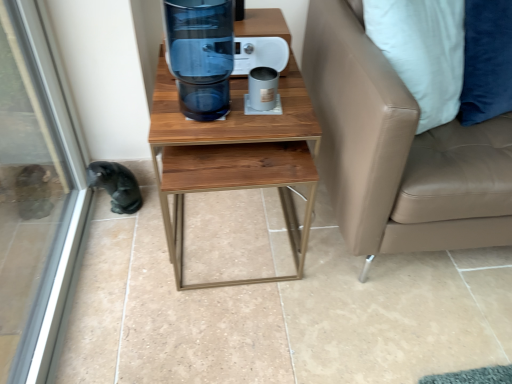
Where is `black fur animal at lower left`? black fur animal at lower left is located at coordinates (116, 185).

What do you see at coordinates (116, 185) in the screenshot?
I see `black fur animal at lower left` at bounding box center [116, 185].

Image resolution: width=512 pixels, height=384 pixels. I want to click on transparent glass water cooler at center, so click(200, 54).

This screenshot has height=384, width=512. What do you see at coordinates (35, 193) in the screenshot?
I see `transparent glass screen door at lower left` at bounding box center [35, 193].

Locate an element on the screen. wooden table at center is located at coordinates (234, 159).

Consider the image. Which object is further away from the camera, transparent glass screen door at lower left or tan leather couch at right?

tan leather couch at right is further away from the camera.

Which is more to the left, transparent glass screen door at lower left or tan leather couch at right?

Positioned to the left is transparent glass screen door at lower left.

How different are the orientations of tan leather couch at right and wooden table at center in degrees?

0.173 degrees separate the facing orientations of tan leather couch at right and wooden table at center.

Could you tell me if tan leather couch at right is turned towards wooden table at center?

No.

In the scene shown: Can we say tan leather couch at right lies outside wooden table at center?

That's correct, tan leather couch at right is outside of wooden table at center.

Is transparent glass water cooler at center further to camera compared to wooden table at center?

That is False.

From the image's perspective, which one is positioned lower, transparent glass water cooler at center or wooden table at center?

wooden table at center, from the image's perspective.

In the scene shown: Between transparent glass water cooler at center and wooden table at center, which one has larger width?

Wider between the two is wooden table at center.

Could black fur animal at lower left be considered to be inside wooden table at center?

That's incorrect, black fur animal at lower left is not inside wooden table at center.

Can you tell me how much wooden table at center and black fur animal at lower left differ in facing direction?

There is a 0.000153-degree angle between the facing directions of wooden table at center and black fur animal at lower left.

Consider the image. Looking at the image, does wooden table at center seem bigger or smaller compared to black fur animal at lower left?

wooden table at center is bigger than black fur animal at lower left.

From the picture: In terms of height, does wooden table at center look taller or shorter compared to black fur animal at lower left?

Considering their sizes, wooden table at center has more height than black fur animal at lower left.

What are the coordinates of `table that is on the left side of tan leather couch at right` in the screenshot? It's located at (234, 159).

Which is closer to the camera, (297, 180) or (401, 168)?

Point (297, 180).

From a real-world perspective, does wooden table at center sit lower than tan leather couch at right?

Yes, from a real-world perspective, wooden table at center is beneath tan leather couch at right.

Which object is wider, wooden table at center or tan leather couch at right?

tan leather couch at right is wider.

You are a GUI agent. You are given a task and a screenshot of the screen. Output one action in this format:
    pyautogui.click(x=<x>, y=<y>)
    Task: Click on the screen door below the wooden table at center (from the image's perspective)
    This screenshot has height=384, width=512.
    Given the screenshot: What is the action you would take?
    pyautogui.click(x=35, y=193)

Between transparent glass screen door at lower left and wooden table at center, which one is positioned behind?

wooden table at center is behind.

Can you tell me how much transparent glass screen door at lower left and wooden table at center differ in facing direction?

The angle between the facing direction of transparent glass screen door at lower left and the facing direction of wooden table at center is 91.5 degrees.

Is transparent glass screen door at lower left far from wooden table at center?

That's not correct — transparent glass screen door at lower left is a little close to wooden table at center.

From a real-world perspective, between black fur animal at lower left and transparent glass screen door at lower left, who is vertically lower?

black fur animal at lower left, from a real-world perspective.

Is black fur animal at lower left facing towards transparent glass screen door at lower left?

No, black fur animal at lower left is not aimed at transparent glass screen door at lower left.

How many degrees apart are the facing directions of black fur animal at lower left and transparent glass screen door at lower left?

91.5 degrees.

Where is `screen door lying in front of the tan leather couch at right`? The image size is (512, 384). screen door lying in front of the tan leather couch at right is located at coordinates pos(35,193).

The height and width of the screenshot is (384, 512). I want to click on table that is behind the tan leather couch at right, so click(234, 159).

Considering their positions, is transparent glass water cooler at center positioned further to black fur animal at lower left than transparent glass screen door at lower left?

transparent glass water cooler at center.

From the image, which object appears to be nearer to black fur animal at lower left, transparent glass screen door at lower left or transparent glass water cooler at center?

transparent glass screen door at lower left is closer to black fur animal at lower left.

From the picture: Based on their spatial positions, is black fur animal at lower left or transparent glass water cooler at center further from wooden table at center?

black fur animal at lower left.

From the image, which object appears to be nearer to transparent glass water cooler at center, transparent glass screen door at lower left or tan leather couch at right?

tan leather couch at right.

Considering their positions, is transparent glass water cooler at center positioned further to wooden table at center than black fur animal at lower left?

black fur animal at lower left lies further to wooden table at center than the other object.

When comparing their distances from black fur animal at lower left, does transparent glass water cooler at center or tan leather couch at right seem closer?

transparent glass water cooler at center is positioned closer to the anchor black fur animal at lower left.

Which object lies further to the anchor point black fur animal at lower left, transparent glass screen door at lower left or wooden table at center?

wooden table at center.

When comparing their distances from transparent glass water cooler at center, does transparent glass screen door at lower left or wooden table at center seem closer?

wooden table at center lies closer to transparent glass water cooler at center than the other object.

Where is `animal between transparent glass screen door at lower left and tan leather couch at right`? animal between transparent glass screen door at lower left and tan leather couch at right is located at coordinates (116, 185).

The width and height of the screenshot is (512, 384). Identify the location of table between black fur animal at lower left and tan leather couch at right. (234, 159).

Where is `table between transparent glass water cooler at center and tan leather couch at right from left to right`? table between transparent glass water cooler at center and tan leather couch at right from left to right is located at coordinates (234, 159).

Locate an element on the screen. The height and width of the screenshot is (384, 512). water cooler between transparent glass screen door at lower left and tan leather couch at right in the horizontal direction is located at coordinates (200, 54).